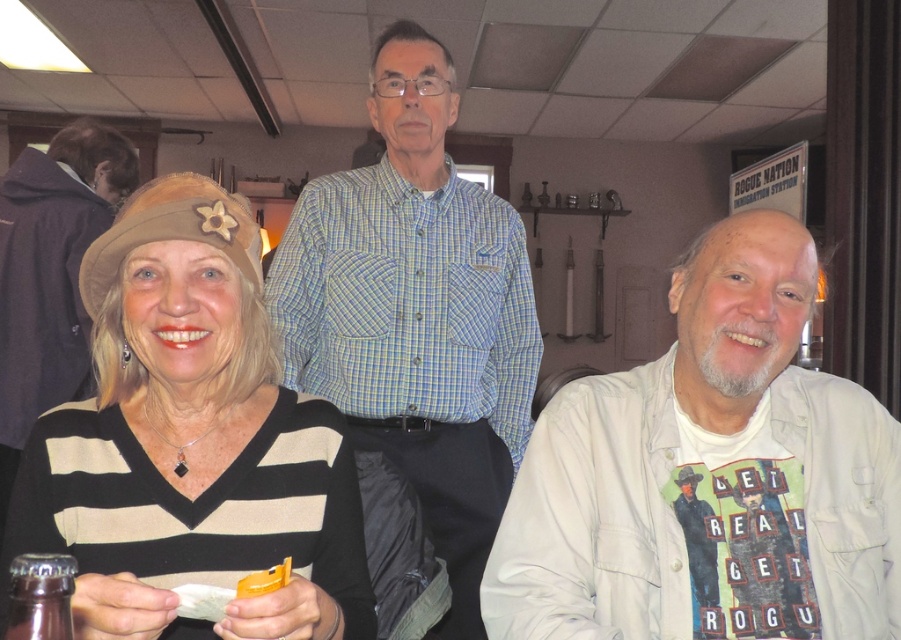
Question: Estimate the real-world distances between objects in this image. Which object is closer to the light blue plaid shirt at center?

Choices:
 (A) brown glass bottle at lower left
 (B) white cotton shirt at right

Answer: (B)

Question: In this image, where is white cotton shirt at right located relative to light blue plaid shirt at center?

Choices:
 (A) below
 (B) above

Answer: (A)

Question: Is light blue plaid shirt at center positioned behind brown glass bottle at lower left?

Choices:
 (A) no
 (B) yes

Answer: (B)

Question: Does light blue plaid shirt at center appear under brown glass bottle at lower left?

Choices:
 (A) no
 (B) yes

Answer: (A)

Question: Which is nearer to the brown glass bottle at lower left?

Choices:
 (A) matte brown hat at left
 (B) white cotton shirt at right

Answer: (A)

Question: Which of the following is the farthest from the observer?

Choices:
 (A) white cotton shirt at right
 (B) matte brown hat at left
 (C) light blue plaid shirt at center
 (D) brown glass bottle at lower left

Answer: (C)